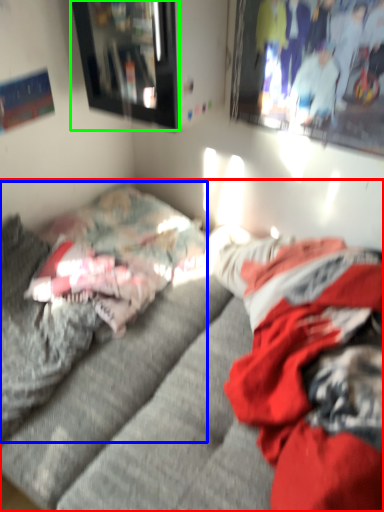
Question: Considering the real-world distances, which object is closest to studio couch (highlighted by a red box)? bed (highlighted by a blue box) or picture frame (highlighted by a green box).

Choices:
 (A) bed
 (B) picture frame

Answer: (A)